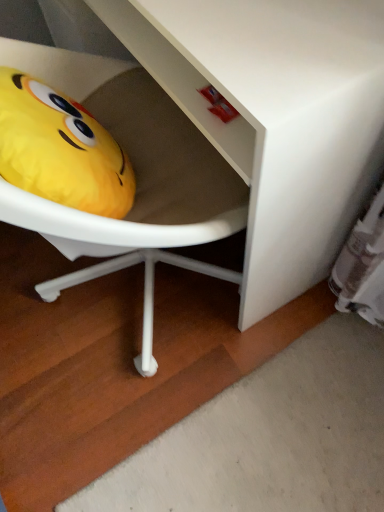
Identify the location of yellow plush toy at left. (60, 149).

Measure the distance between yellow plush toy at left and camera.

yellow plush toy at left is 21.79 inches from camera.

The image size is (384, 512). Describe the element at coordinates (60, 149) in the screenshot. I see `yellow plush toy at left` at that location.

Measure the distance between white matte vanity at lower left and camera.

The distance of white matte vanity at lower left from camera is 18.69 inches.

Where is `white matte vanity at lower left`? white matte vanity at lower left is located at coordinates (275, 117).

The image size is (384, 512). What do you see at coordinates (275, 117) in the screenshot?
I see `white matte vanity at lower left` at bounding box center [275, 117].

Identify the location of yellow plush toy at left. (60, 149).

Does white matte vanity at lower left appear on the left side of yellow plush toy at left?

No, white matte vanity at lower left is not to the left of yellow plush toy at left.

Is white matte vanity at lower left positioned before yellow plush toy at left?

Yes, white matte vanity at lower left is closer to the camera.

Which is nearer, (286, 32) or (64, 98)?

Clearly, point (286, 32) is closer to the camera than point (64, 98).

From the image's perspective, is white matte vanity at lower left on top of yellow plush toy at left?

Yes, from the image's perspective, white matte vanity at lower left is over yellow plush toy at left.

From a real-world perspective, between white matte vanity at lower left and yellow plush toy at left, who is vertically higher?

yellow plush toy at left.

Does white matte vanity at lower left have a lesser width compared to yellow plush toy at left?

No.

Is white matte vanity at lower left taller than yellow plush toy at left?

Yes.

Looking at the image, does white matte vanity at lower left seem bigger or smaller compared to yellow plush toy at left?

white matte vanity at lower left is bigger than yellow plush toy at left.

Is white matte vanity at lower left situated inside yellow plush toy at left or outside?

white matte vanity at lower left is spatially situated outside yellow plush toy at left.

Is there a large distance between white matte vanity at lower left and yellow plush toy at left?

No, white matte vanity at lower left is in close proximity to yellow plush toy at left.

Based on the photo, is white matte vanity at lower left positioned with its back to yellow plush toy at left?

No, yellow plush toy at left is not at the back of white matte vanity at lower left.

How many degrees apart are the facing directions of white matte vanity at lower left and yellow plush toy at left?

There is a 180-degree angle between the facing directions of white matte vanity at lower left and yellow plush toy at left.

Find the location of a particular element. The image size is (384, 512). vanity above the yellow plush toy at left (from the image's perspective) is located at coordinates (275, 117).

Which is more to the left, yellow plush toy at left or white matte vanity at lower left?

From the viewer's perspective, yellow plush toy at left appears more on the left side.

Does yellow plush toy at left come in front of white matte vanity at lower left?

No, yellow plush toy at left is behind white matte vanity at lower left.

Does point (26, 158) appear closer or farther from the camera than point (325, 209)?

Point (26, 158) is positioned closer to the camera compared to point (325, 209).

From the image's perspective, between yellow plush toy at left and white matte vanity at lower left, who is located below?

yellow plush toy at left appears lower in the image.

From a real-world perspective, does yellow plush toy at left sit lower than white matte vanity at lower left?

Incorrect, from a real-world perspective, yellow plush toy at left is higher than white matte vanity at lower left.

Considering the sizes of objects yellow plush toy at left and white matte vanity at lower left in the image provided, who is thinner, yellow plush toy at left or white matte vanity at lower left?

yellow plush toy at left is thinner.

Does yellow plush toy at left have a greater height compared to white matte vanity at lower left?

No.

Is yellow plush toy at left bigger than white matte vanity at lower left?

Actually, yellow plush toy at left might be smaller than white matte vanity at lower left.

Is yellow plush toy at left surrounding white matte vanity at lower left?

Actually, white matte vanity at lower left is outside yellow plush toy at left.

Is yellow plush toy at left next to white matte vanity at lower left and touching it?

No, yellow plush toy at left is not next to white matte vanity at lower left.

Is yellow plush toy at left facing away from white matte vanity at lower left?

No.

How distant is yellow plush toy at left from white matte vanity at lower left?

yellow plush toy at left and white matte vanity at lower left are 10.93 inches apart.

Locate an element on the screen. vanity below the yellow plush toy at left (from a real-world perspective) is located at coordinates (275, 117).

Identify the location of vanity on the right of yellow plush toy at left. (275, 117).

You are a GUI agent. You are given a task and a screenshot of the screen. Output one action in this format:
    pyautogui.click(x=<x>, y=<y>)
    Task: Click on the toy above the white matte vanity at lower left (from a real-world perspective)
    The height and width of the screenshot is (512, 384).
    Given the screenshot: What is the action you would take?
    pyautogui.click(x=60, y=149)